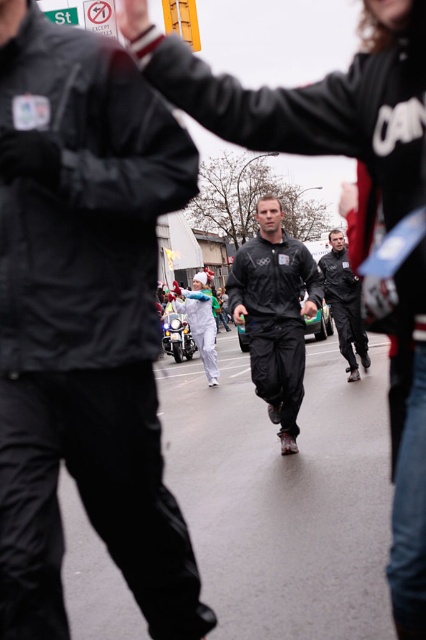
Question: Does black matte suit at center have a smaller size compared to black matte jacket at center?

Choices:
 (A) yes
 (B) no

Answer: (B)

Question: Which is farther from the black matte suit at center?

Choices:
 (A) matte black tracksuit at center
 (B) black matte jacket at center

Answer: (B)

Question: Is matte black tracksuit at center above black matte jacket at center?

Choices:
 (A) no
 (B) yes

Answer: (A)

Question: Is the position of black matte suit at center less distant than that of matte black tracksuit at center?

Choices:
 (A) no
 (B) yes

Answer: (B)

Question: Which of the following is the closest to the observer?

Choices:
 (A) (23, 618)
 (B) (239, 321)
 (C) (334, 259)

Answer: (A)

Question: Which of the following is the farthest from the observer?

Choices:
 (A) black matte jacket at center
 (B) matte black tracksuit at center
 (C) black matte suit at center

Answer: (A)